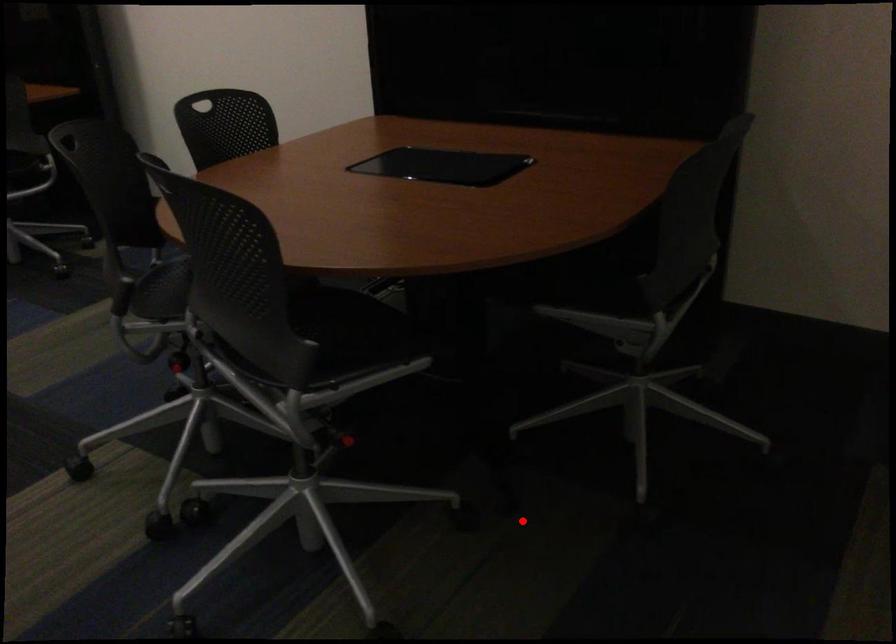
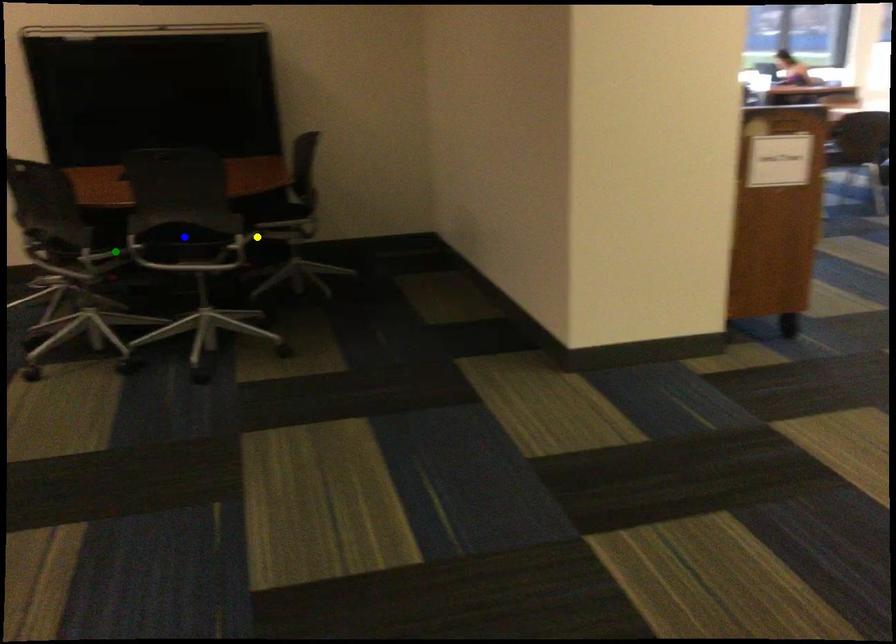
Question: I am providing you with two images of the same scene from different viewpoints. A red point is marked on the first image. You are given multiple points on the second image. Which point in image 2 represents the same 3d spot as the red point in image 1?

Choices:
 (A) green point
 (B) yellow point
 (C) blue point

Answer: (B)